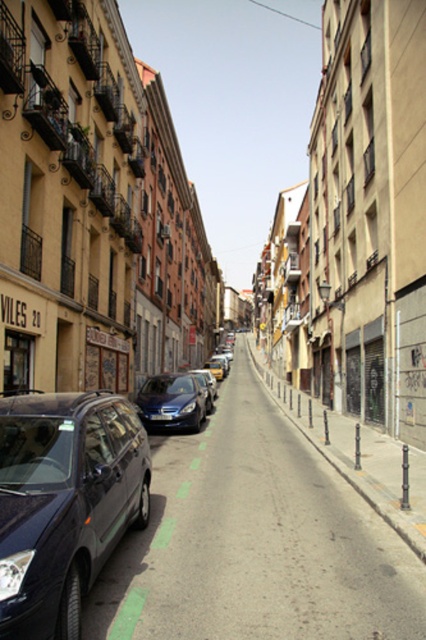
Question: Which object appears closest to the camera in this image?

Choices:
 (A) metallic blue minivan at left
 (B) shiny blue sedan at center

Answer: (A)

Question: Which is farther from the metallic gray car at left?

Choices:
 (A) black plastic license plate at center
 (B) shiny blue sedan at center

Answer: (A)

Question: Which is nearer to the black plastic license plate at center?

Choices:
 (A) metallic blue minivan at left
 (B) metallic gray car at left

Answer: (B)

Question: Is metallic gray car at left to the right of black plastic license plate at center from the viewer's perspective?

Choices:
 (A) no
 (B) yes

Answer: (B)

Question: Is metallic gray car at left thinner than shiny blue sedan at center?

Choices:
 (A) no
 (B) yes

Answer: (A)

Question: Where is metallic blue minivan at left located in relation to shiny blue sedan at center in the image?

Choices:
 (A) right
 (B) left

Answer: (A)